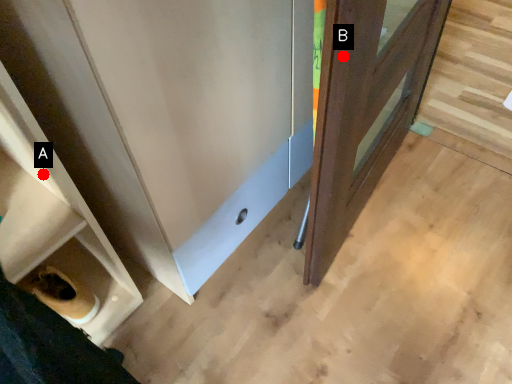
Question: Two points are circled on the image, labeled by A and B beside each circle. Which point is closer to the camera?

Choices:
 (A) A is closer
 (B) B is closer

Answer: (B)